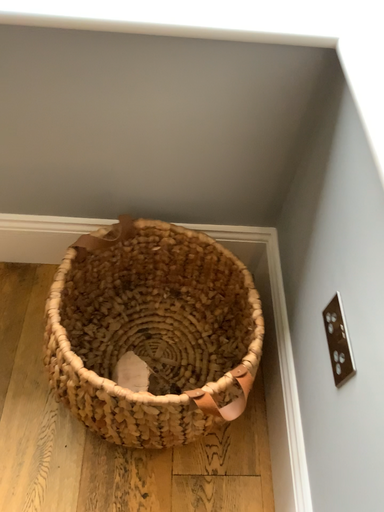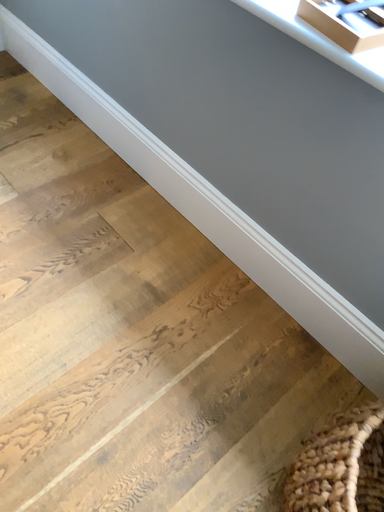
Question: How did the camera likely rotate when shooting the video?

Choices:
 (A) rotated downward
 (B) rotated upward

Answer: (B)